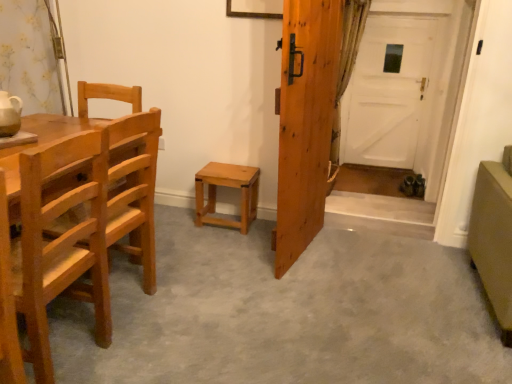
What are the coordinates of `empty space that is in between wooden door at center, which is counted as the 1th door, starting from the left, and light brown wood chair at left, the 2th chair viewed from the front` in the screenshot? It's located at point(221,269).